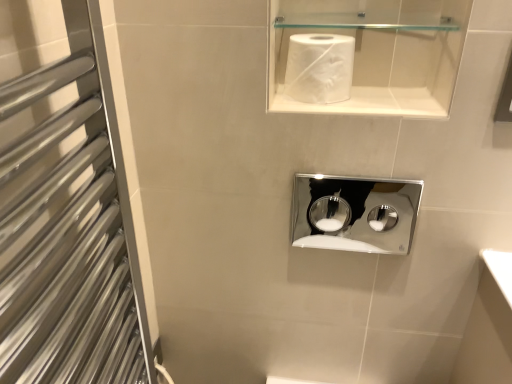
Question: Can you confirm if white matte paper towel at upper center is taller than chrome/metallic medicine cabinet at center?

Choices:
 (A) no
 (B) yes

Answer: (A)

Question: Is the position of white matte paper towel at upper center more distant than that of chrome/metallic medicine cabinet at center?

Choices:
 (A) yes
 (B) no

Answer: (B)

Question: Considering the relative sizes of white matte paper towel at upper center and chrome/metallic medicine cabinet at center in the image provided, is white matte paper towel at upper center bigger than chrome/metallic medicine cabinet at center?

Choices:
 (A) no
 (B) yes

Answer: (B)

Question: Considering the relative positions of white matte paper towel at upper center and chrome/metallic medicine cabinet at center in the image provided, is white matte paper towel at upper center in front of chrome/metallic medicine cabinet at center?

Choices:
 (A) yes
 (B) no

Answer: (A)

Question: Would you say white matte paper towel at upper center contains chrome/metallic medicine cabinet at center?

Choices:
 (A) no
 (B) yes

Answer: (A)

Question: Is white matte paper towel at upper center facing towards chrome/metallic medicine cabinet at center?

Choices:
 (A) yes
 (B) no

Answer: (B)

Question: Is silver metallic towel rack at left oriented away from chrome/metallic medicine cabinet at center?

Choices:
 (A) yes
 (B) no

Answer: (B)

Question: From a real-world perspective, is silver metallic towel rack at left over chrome/metallic medicine cabinet at center?

Choices:
 (A) no
 (B) yes

Answer: (B)

Question: Is the depth of silver metallic towel rack at left greater than that of chrome/metallic medicine cabinet at center?

Choices:
 (A) yes
 (B) no

Answer: (B)

Question: From the image's perspective, would you say silver metallic towel rack at left is positioned over chrome/metallic medicine cabinet at center?

Choices:
 (A) yes
 (B) no

Answer: (B)

Question: Is silver metallic towel rack at left not close to chrome/metallic medicine cabinet at center?

Choices:
 (A) yes
 (B) no

Answer: (A)

Question: Is chrome/metallic medicine cabinet at center a part of silver metallic towel rack at left?

Choices:
 (A) no
 (B) yes

Answer: (A)

Question: Considering the relative sizes of chrome/metallic medicine cabinet at center and silver metallic towel rack at left in the image provided, is chrome/metallic medicine cabinet at center taller than silver metallic towel rack at left?

Choices:
 (A) yes
 (B) no

Answer: (B)